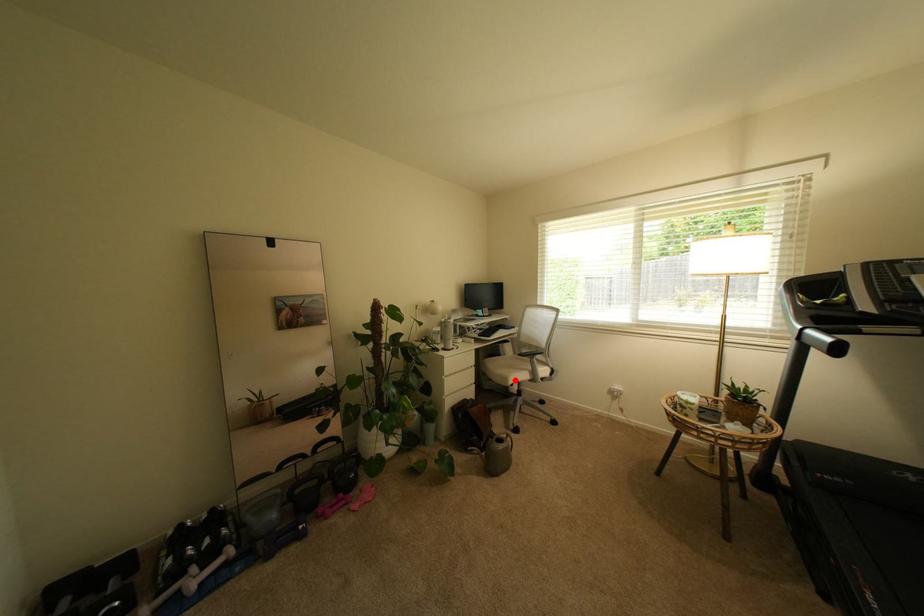
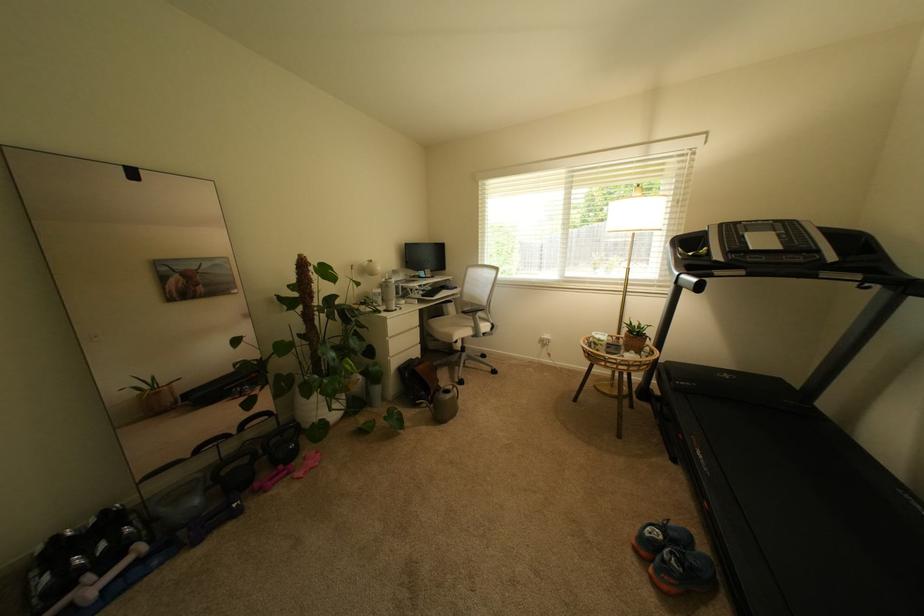
In the second image, find the point that corresponds to the highlighted location in the first image.

(459, 338)